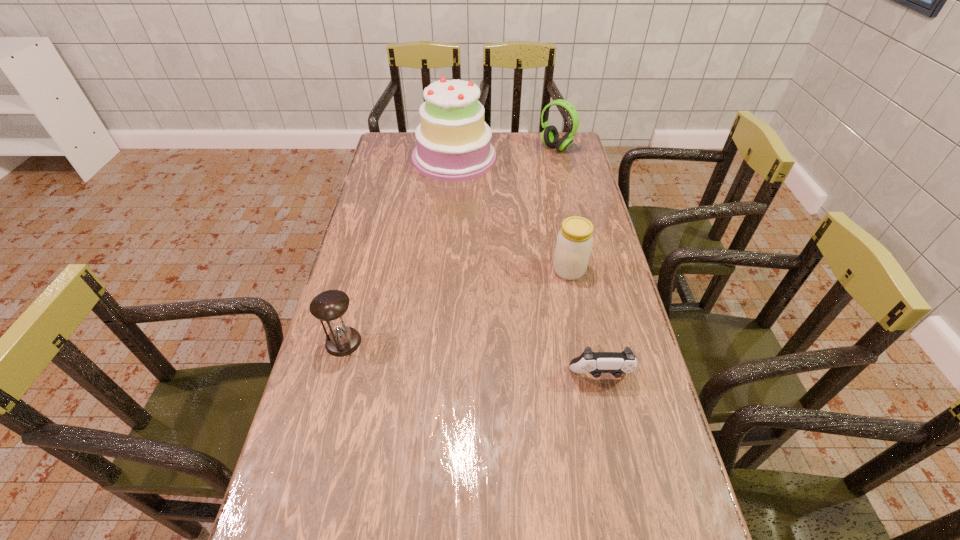
Where is `object that is at the far left corner`? object that is at the far left corner is located at coordinates (453, 143).

Find the location of a particular element. object situated at the far right corner is located at coordinates (550, 136).

The width and height of the screenshot is (960, 540). What are the coordinates of `vacant space at the far edge` in the screenshot? It's located at (526, 156).

I want to click on vacant point at the left edge, so click(x=357, y=248).

The height and width of the screenshot is (540, 960). In the image, there is a desktop. Find the location of `free space at the right edge`. free space at the right edge is located at coordinates (607, 413).

In the image, there is a desktop. At what (x,y) coordinates should I click in order to perform the action: click on blank space at the far left corner. Please return your answer as a coordinate pair (x, y). This screenshot has height=540, width=960. Looking at the image, I should click on (411, 156).

This screenshot has height=540, width=960. In order to click on vacant point located between the headset and the tallest object in this screenshot , I will do `click(505, 153)`.

At what (x,y) coordinates should I click in order to perform the action: click on free space between the shortest object and the tallest object. Please return your answer as a coordinate pair (x, y). The height and width of the screenshot is (540, 960). Looking at the image, I should click on (528, 267).

The image size is (960, 540). In order to click on unoccupied area between the second shortest object and the third nearest object in this screenshot , I will do `click(456, 306)`.

Where is `unoccupied area between the leftmost object and the third farthest object`? The image size is (960, 540). unoccupied area between the leftmost object and the third farthest object is located at coordinates (456, 306).